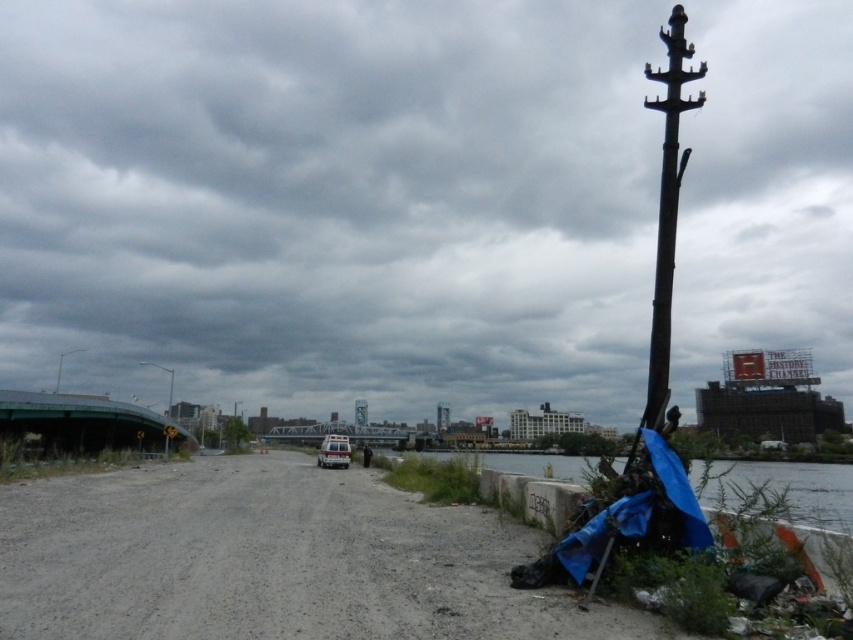
You are a city inspector checking the structural integrity of the metallic gray pole at left and the metallic gray streetlight at left. Which of these two objects has a smaller diameter?

The metallic gray pole at left is thinner than the metallic gray streetlight at left, so the metallic gray pole at left has a smaller diameter.

From the picture: You are standing at the point with coordinates point (x=164, y=448) and want to walk to the point with coordinates point (x=73, y=353). Which direction should you move relative to the point you are currently at?

You should move backward because point (x=73, y=353) is behind point (x=164, y=448).